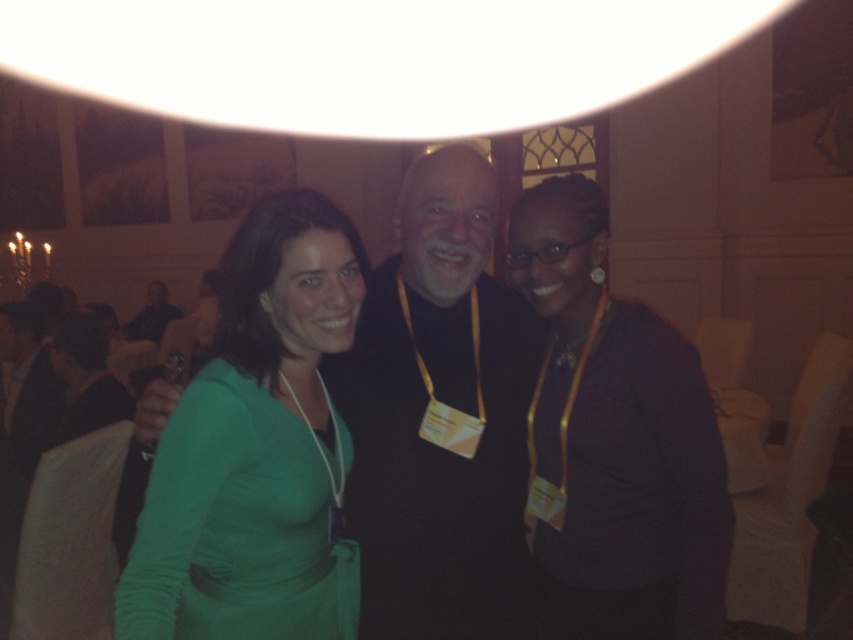
Question: Among these points, which one is farthest from the camera?

Choices:
 (A) (467, 349)
 (B) (149, 314)
 (C) (660, 460)
 (D) (300, 483)

Answer: (B)

Question: Among these objects, which one is farthest from the camera?

Choices:
 (A) green matte dress at center
 (B) black matte jacket at center
 (C) dark brown leather jacket at left
 (D) purple matte sweater at center

Answer: (C)

Question: Is green matte dress at center to the right of black matte jacket at center from the viewer's perspective?

Choices:
 (A) yes
 (B) no

Answer: (B)

Question: Does green fabric dress at center appear on the left side of dark brown leather jacket at left?

Choices:
 (A) no
 (B) yes

Answer: (A)

Question: Which object is farther from the camera taking this photo?

Choices:
 (A) dark brown leather jacket at left
 (B) green fabric dress at center
 (C) purple matte sweater at center
 (D) black matte jacket at center

Answer: (A)

Question: Is green fabric dress at center positioned before purple matte sweater at center?

Choices:
 (A) no
 (B) yes

Answer: (B)